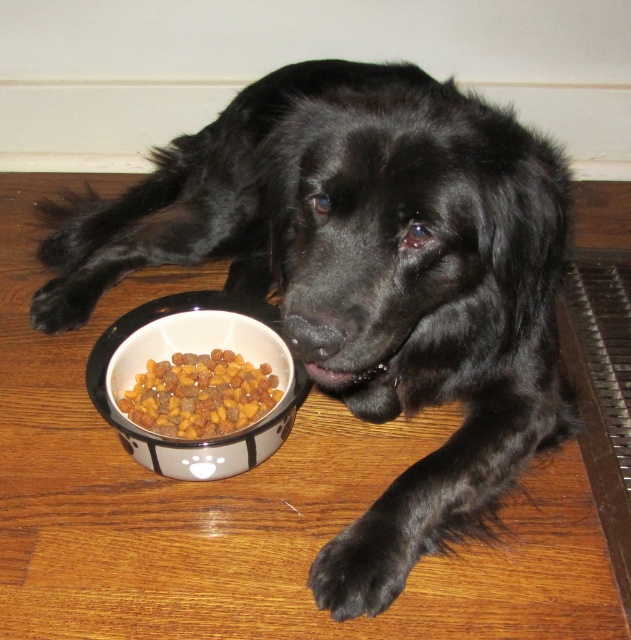
Does white glossy bowl at lower left have a greater height compared to brown crunchy kibble at lower left?

Yes.

Can you confirm if white glossy bowl at lower left is positioned above brown crunchy kibble at lower left?

Correct, white glossy bowl at lower left is located above brown crunchy kibble at lower left.

I want to click on white glossy bowl at lower left, so click(x=192, y=349).